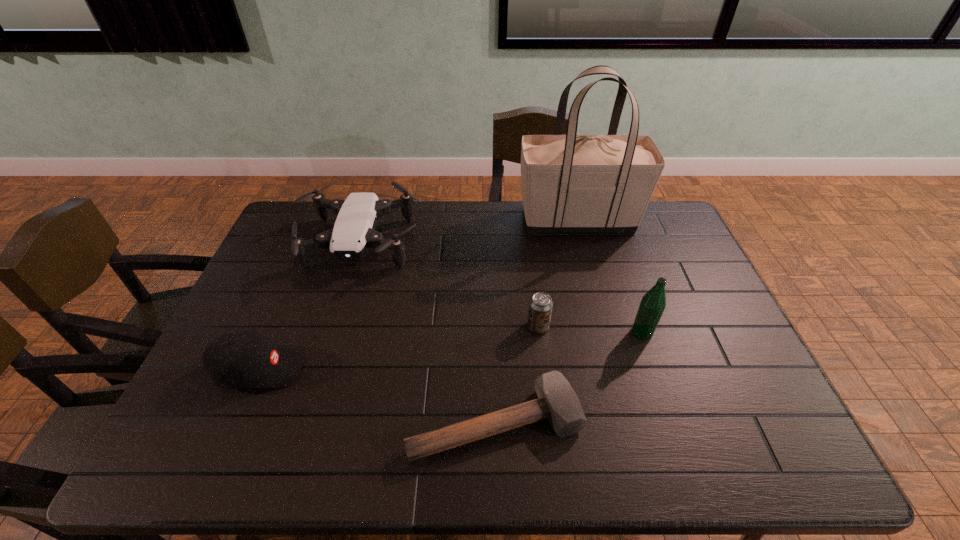
Locate an element on the screen. The width and height of the screenshot is (960, 540). vacant space that satisfies the following two spatial constraints: 1. on the camera side of the drone; 2. on the right side of the beer can is located at coordinates click(x=335, y=327).

Locate an element on the screen. vacant space that satisfies the following two spatial constraints: 1. on the camera side of the fifth shortest object; 2. on the left side of the drone is located at coordinates (333, 333).

Identify the location of free space that satisfies the following two spatial constraints: 1. on the front side of the bottle; 2. with a logo on the front of the baseball cap. The width and height of the screenshot is (960, 540). (655, 369).

Find the location of a particular element. blank space that satisfies the following two spatial constraints: 1. on the camera side of the shortest object; 2. on the left side of the drone is located at coordinates (306, 423).

Where is `free space that satisfies the following two spatial constraints: 1. with handles facing forward on the tallest object; 2. on the camera side of the drone`? free space that satisfies the following two spatial constraints: 1. with handles facing forward on the tallest object; 2. on the camera side of the drone is located at coordinates pyautogui.click(x=584, y=245).